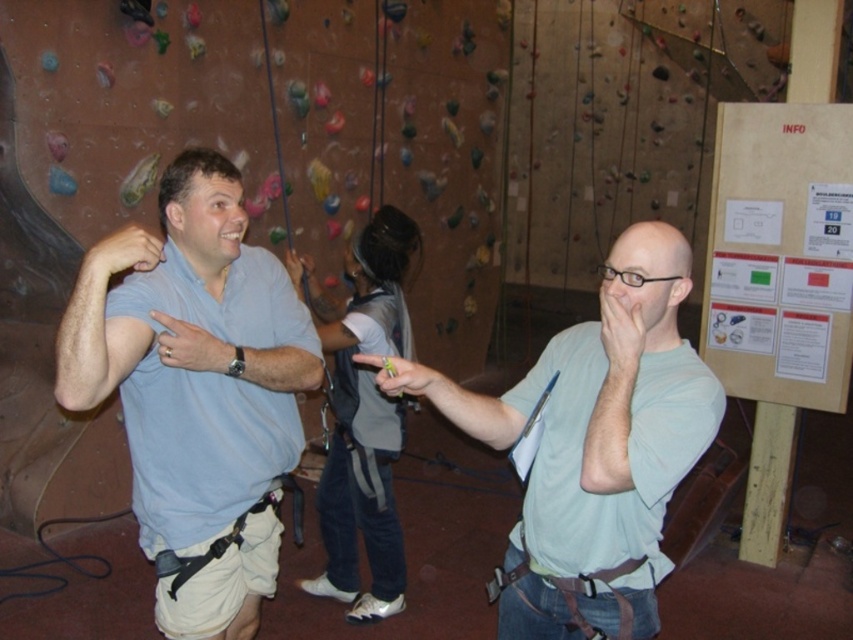
Question: Does light blue shirt at center appear over dark gray climbing harness at center?

Choices:
 (A) yes
 (B) no

Answer: (A)

Question: Does light blue shirt at center have a greater width compared to dark gray climbing harness at center?

Choices:
 (A) yes
 (B) no

Answer: (B)

Question: Is light green t-shirt at center wider than dark gray climbing harness at center?

Choices:
 (A) yes
 (B) no

Answer: (A)

Question: Which of the following is the closest to the observer?

Choices:
 (A) light blue shirt at center
 (B) dark gray climbing harness at center
 (C) light green t-shirt at center

Answer: (C)

Question: Which point is closer to the camera?

Choices:
 (A) dark gray climbing harness at center
 (B) light green t-shirt at center
 (C) light blue shirt at center

Answer: (B)

Question: Estimate the real-world distances between objects in this image. Which object is closer to the light blue shirt at center?

Choices:
 (A) dark gray climbing harness at center
 (B) light green t-shirt at center

Answer: (B)